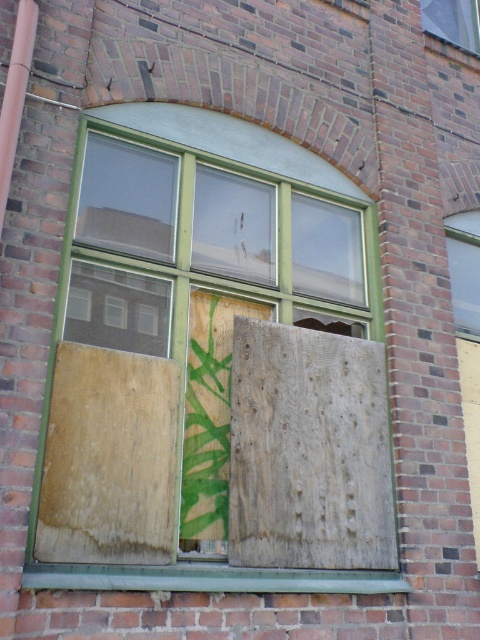
Is green painted wood at center thinner than clear glass window at upper center?

In fact, green painted wood at center might be wider than clear glass window at upper center.

Does green painted wood at center appear on the left side of clear glass window at upper center?

Indeed, green painted wood at center is positioned on the left side of clear glass window at upper center.

Image resolution: width=480 pixels, height=640 pixels. What are the coordinates of `green painted wood at center` in the screenshot? It's located at [215, 369].

Who is taller, green painted wood at bottom or wooden board at right?

wooden board at right

Who is more distant from viewer, (99,572) or (476,300)?

Point (476,300)

Between point (207, 592) and point (451, 268), which one is positioned behind?

Point (451, 268)

At what (x,y) coordinates should I click in order to perform the action: click on green painted wood at bottom. Please return your answer as a coordinate pair (x, y). Image resolution: width=480 pixels, height=640 pixels. Looking at the image, I should click on (208, 579).

Who is lower down, green painted wood at center or green painted wood at bottom?

Positioned lower is green painted wood at bottom.

In the scene shown: Is green painted wood at center shorter than green painted wood at bottom?

No.

Where is `green painted wood at center`? green painted wood at center is located at coordinates 215,369.